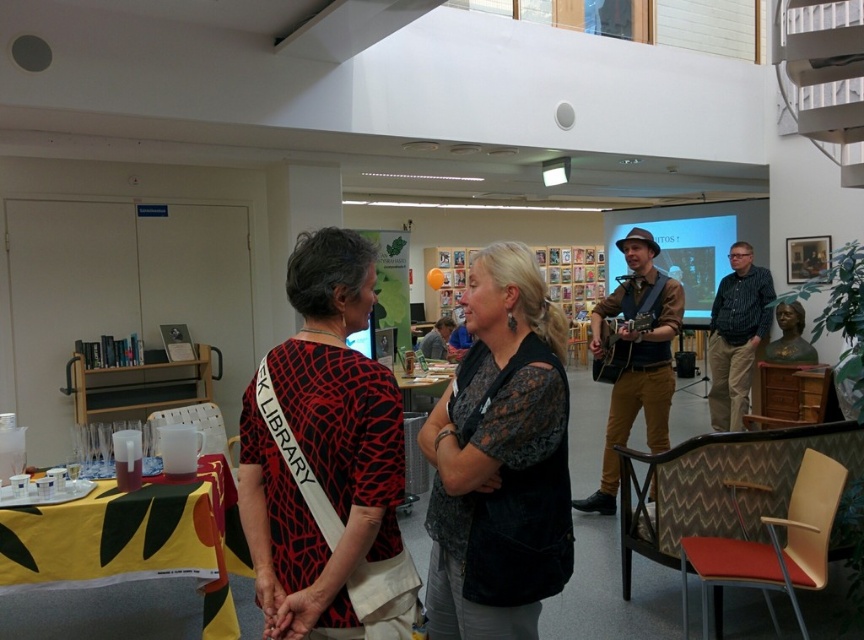
Consider the image. Who is positioned more to the left, black lace blouse at center or yellow fabric table at lower left?

yellow fabric table at lower left

Can you confirm if black lace blouse at center is wider than yellow fabric table at lower left?

No, black lace blouse at center is not wider than yellow fabric table at lower left.

Locate an element on the screen. black lace blouse at center is located at coordinates (499, 460).

Describe the element at coordinates (322, 449) in the screenshot. The width and height of the screenshot is (864, 640). I see `black printed dress at center` at that location.

Which is more to the right, black printed dress at center or yellow fabric table at lower left?

Positioned to the right is black printed dress at center.

Does point (369, 401) come farther from viewer compared to point (130, 509)?

No, (369, 401) is in front of (130, 509).

Where is `black printed dress at center`? black printed dress at center is located at coordinates (322, 449).

At what (x,y) coordinates should I click in order to perform the action: click on black printed dress at center. Please return your answer as a coordinate pair (x, y). Image resolution: width=864 pixels, height=640 pixels. Looking at the image, I should click on (322, 449).

The height and width of the screenshot is (640, 864). In order to click on black printed dress at center in this screenshot , I will do `click(322, 449)`.